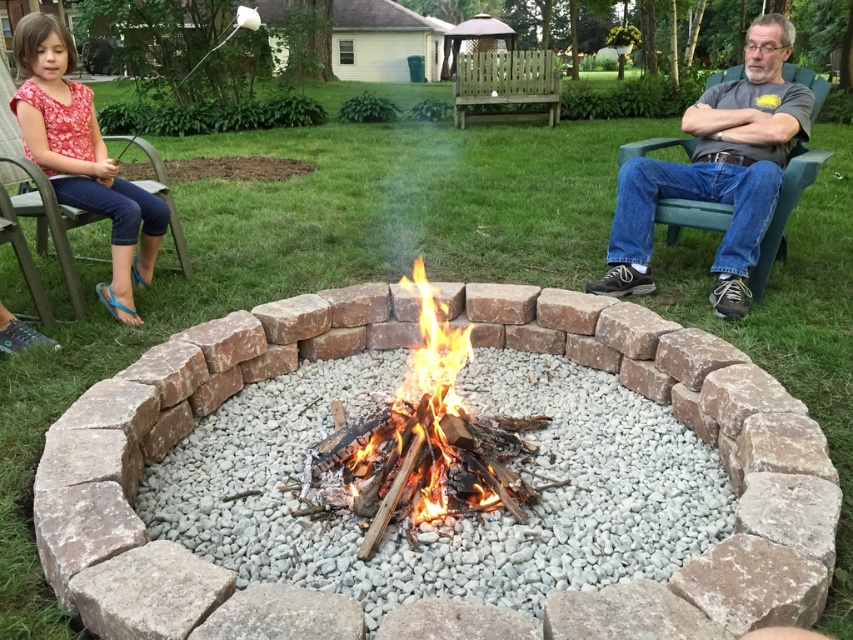
Question: Which is nearer to the red brick fire pit at center?

Choices:
 (A) floral fabric dress at left
 (B) gray t-shirt at right

Answer: (B)

Question: Which object is closer to the camera taking this photo?

Choices:
 (A) red brick fire pit at center
 (B) floral fabric dress at left

Answer: (A)

Question: Is flaming wood fire at center above floral fabric dress at left?

Choices:
 (A) no
 (B) yes

Answer: (A)

Question: Does red brick fire pit at center appear over gray t-shirt at right?

Choices:
 (A) yes
 (B) no

Answer: (B)

Question: Among these objects, which one is farthest from the camera?

Choices:
 (A) red brick fire pit at center
 (B) flaming wood fire at center
 (C) gray t-shirt at right
 (D) floral fabric dress at left

Answer: (C)

Question: Is red brick fire pit at center positioned before floral fabric dress at left?

Choices:
 (A) no
 (B) yes

Answer: (B)